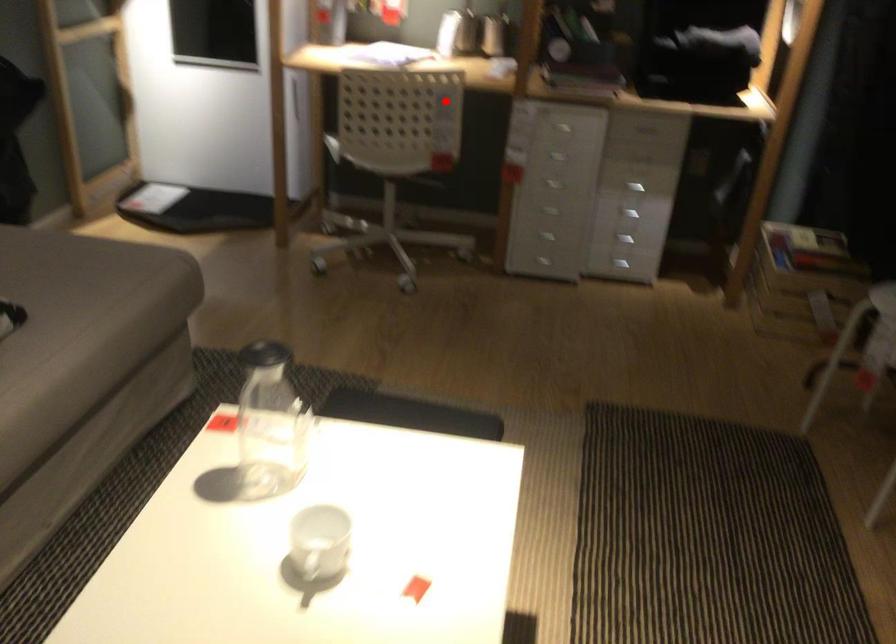
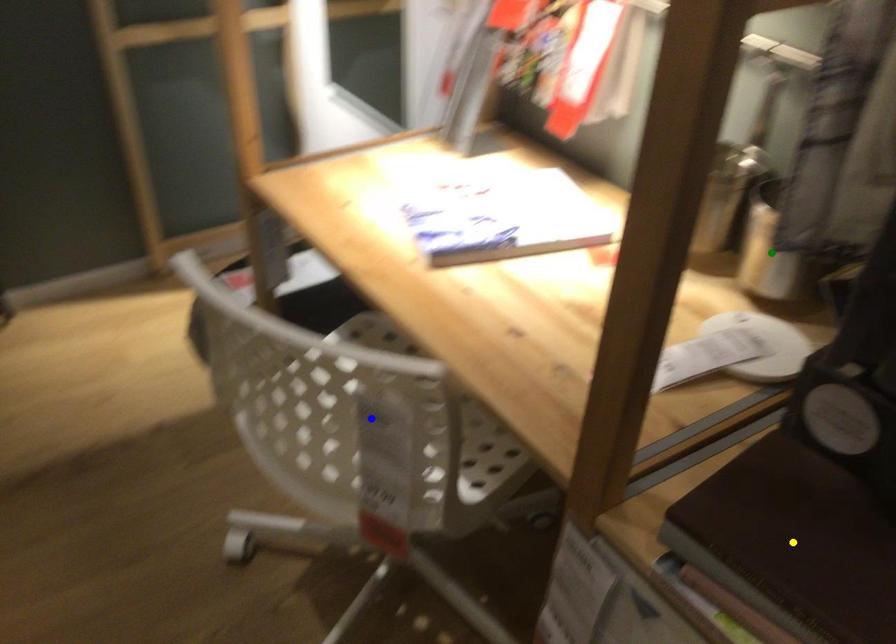
Question: I am providing you with two images of the same scene from different viewpoints. A red point is marked on the first image. You are given multiple points on the second image. Which point in image 2 is actually the same real-world point as the red point in image 1?

Choices:
 (A) yellow point
 (B) blue point
 (C) green point

Answer: (B)